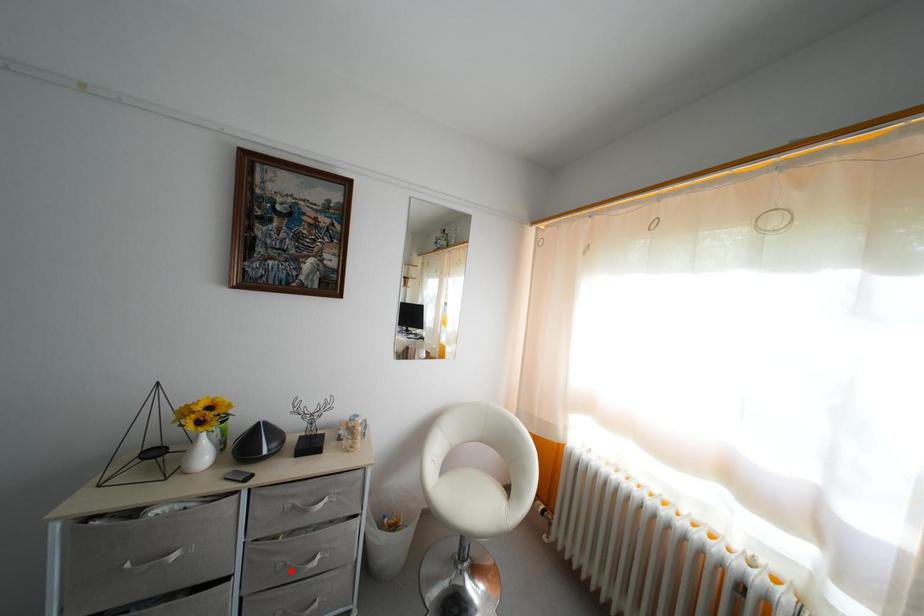
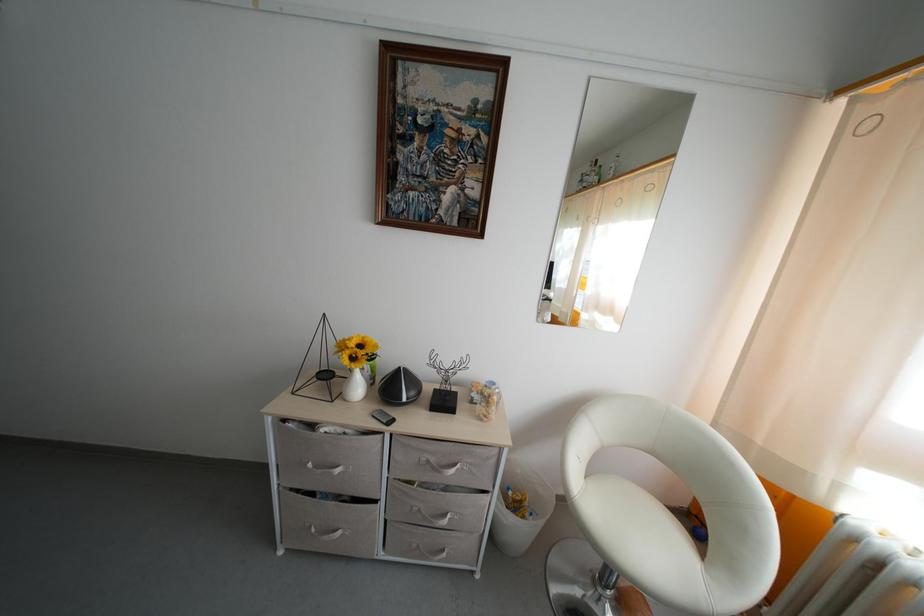
Locate, in the second image, the point that corresponds to the highlighted location in the first image.

(426, 517)